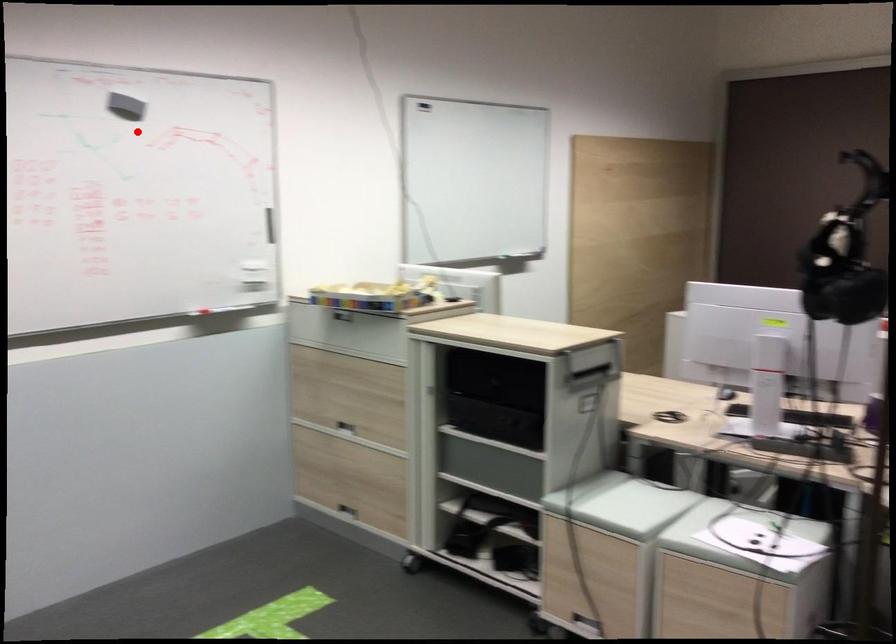
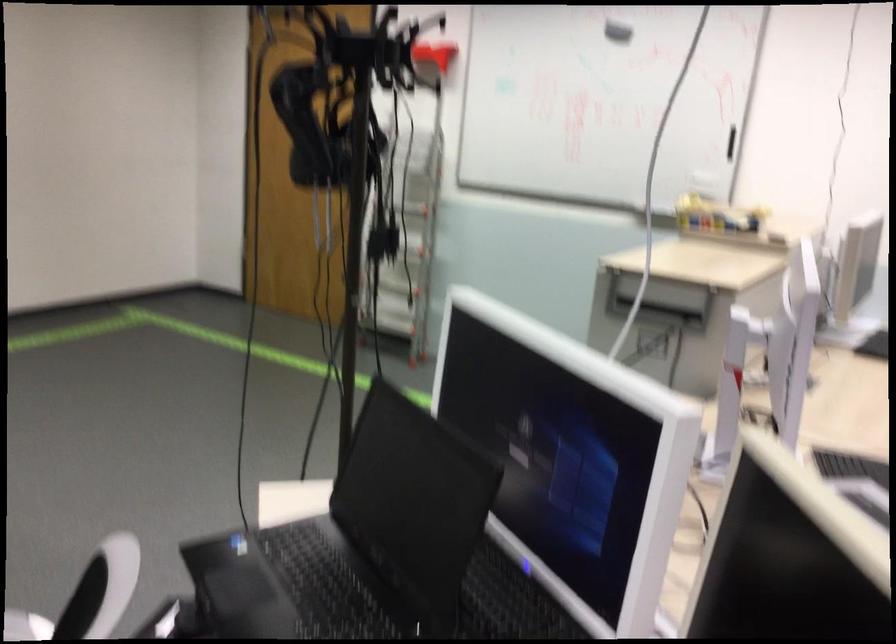
Locate, in the second image, the point that corresponds to the highlighted location in the first image.

(617, 32)